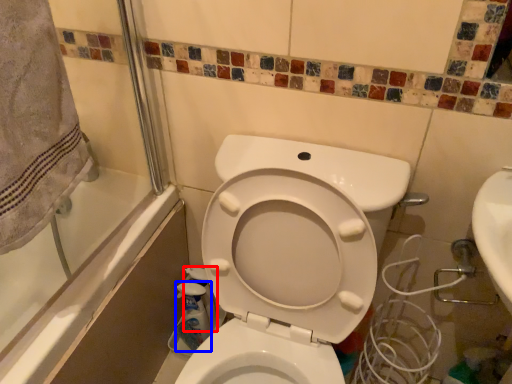
Question: Which point is further to the camera, cleaning product (highlighted by a red box) or cleaning product (highlighted by a blue box)?

Choices:
 (A) cleaning product
 (B) cleaning product

Answer: (A)